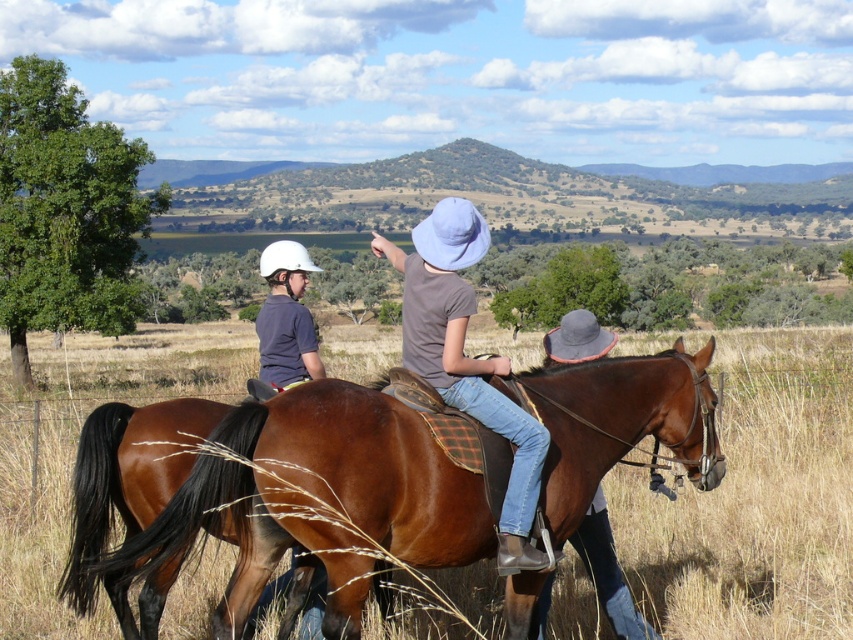
You are a photographer aiming to capture a clear shot of the denim jeans at center and the matte white helmet at left. Based on their positions, which object is positioned higher in the image?

The denim jeans at center is located above the matte white helmet at left, so the denim jeans at center is higher in the image.

You are a photographer trying to capture a clear photo of the shiny brown horse at center and the matte white helmet at left. Based on their sizes in the image, which object would appear larger in your photo?

The matte white helmet at left appears larger in the photo because it is larger than the shiny brown horse at center.

You are a photographer trying to capture the shiny brown horse at center and the matte white helmet at left in the same frame. Based on their positions, which object is located to the left of the other?

The matte white helmet at left is located to the left of the shiny brown horse at center.